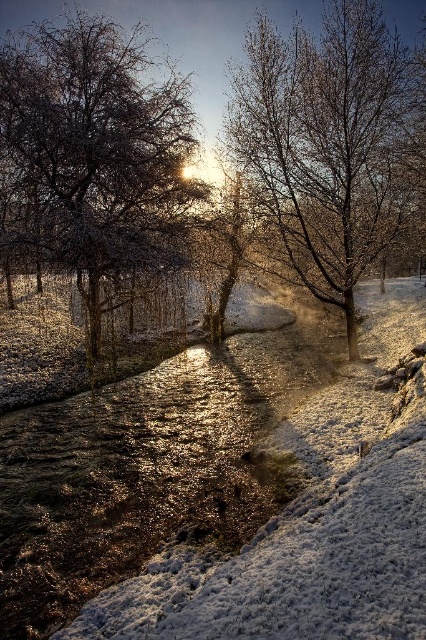
Who is shorter, frosty bark tree at center or snow-covered tree at center?

frosty bark tree at center is shorter.

Is frosty bark tree at center below snow-covered tree at center?

Yes.

Between point (170, 131) and point (373, 163), which one is positioned behind?

Point (170, 131)

You are a GUI agent. You are given a task and a screenshot of the screen. Output one action in this format:
    pyautogui.click(x=<x>, y=<y>)
    Task: Click on the frosty bark tree at center
    Image resolution: width=426 pixels, height=640 pixels.
    Given the screenshot: What is the action you would take?
    pyautogui.click(x=95, y=157)